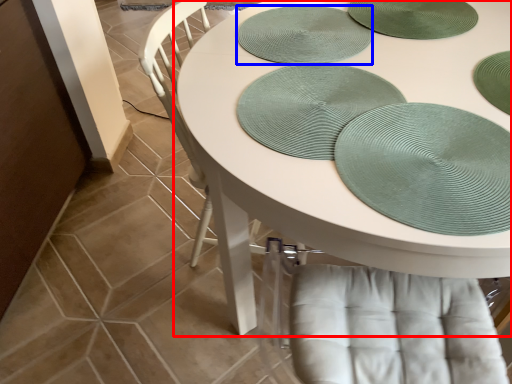
Question: Which point is closer to the camera, table (highlighted by a red box) or platter (highlighted by a blue box)?

Choices:
 (A) table
 (B) platter

Answer: (A)